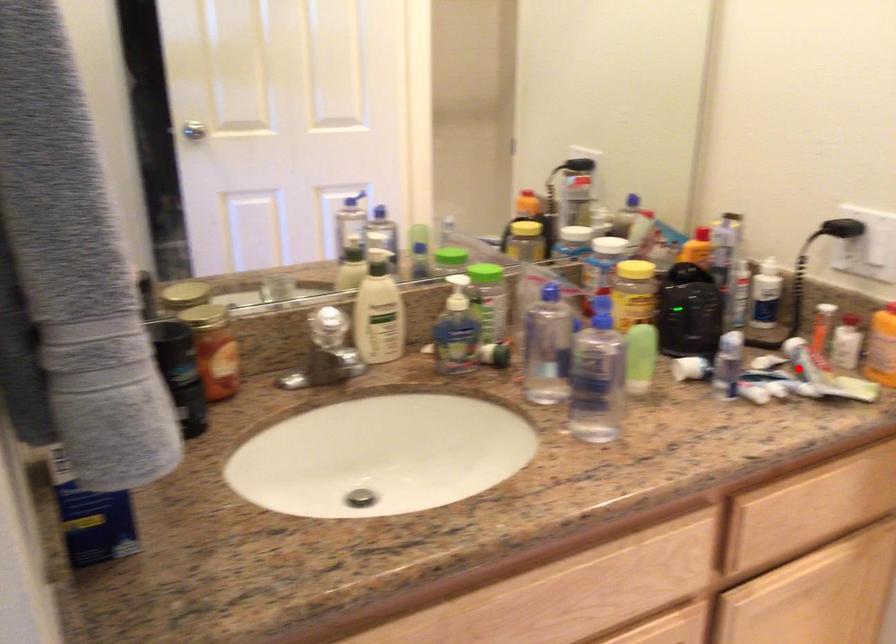
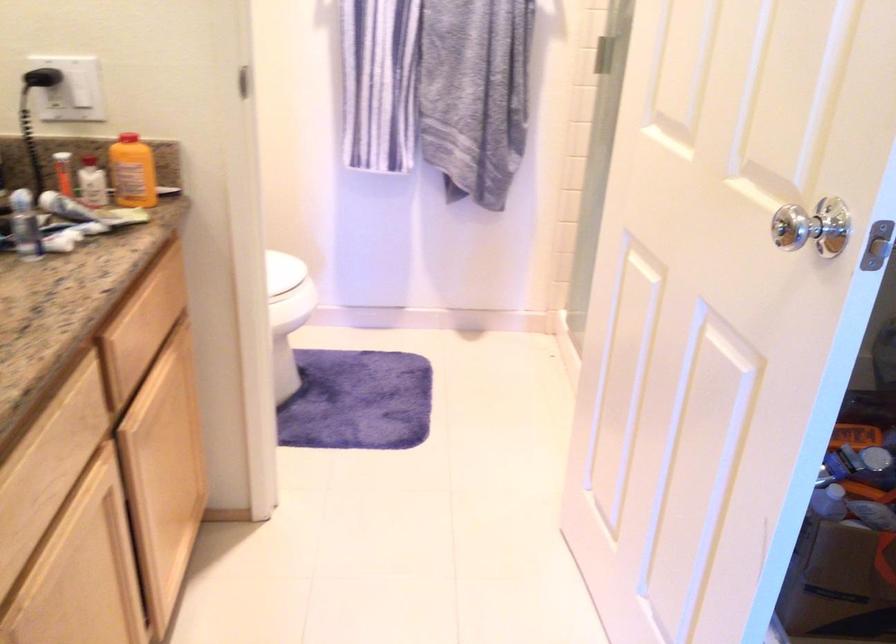
Find the pixel in the second image that matches the highlighted location in the first image.

(89, 211)